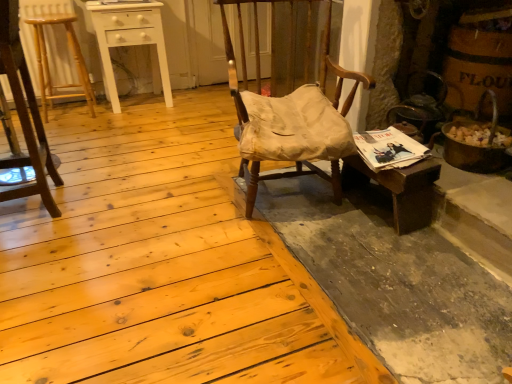
The height and width of the screenshot is (384, 512). I want to click on wooden chair with worn fabric cushion at center, the second chair positioned from the left, so click(244, 51).

Where is `wooden desk at right`? This screenshot has width=512, height=384. wooden desk at right is located at coordinates (401, 189).

What do you see at coordinates (128, 40) in the screenshot? The image size is (512, 384). I see `white wood table at upper left` at bounding box center [128, 40].

What do you see at coordinates (419, 111) in the screenshot? This screenshot has height=384, width=512. I see `metallic gold swivel chair at right` at bounding box center [419, 111].

The image size is (512, 384). Find the location of `light brown wood bar stool at left`. light brown wood bar stool at left is located at coordinates (48, 64).

The width and height of the screenshot is (512, 384). Find the location of `wooden chair with worn fabric cushion at center, the first chair in the right-to-left sequence`. wooden chair with worn fabric cushion at center, the first chair in the right-to-left sequence is located at coordinates (244, 51).

Which of these two, matte paper magazine at right or metallic gold swivel chair at right, stands taller?

metallic gold swivel chair at right is taller.

The width and height of the screenshot is (512, 384). In order to click on swivel chair above the matte paper magazine at right (from a real-world perspective) in this screenshot , I will do `click(419, 111)`.

Would you say matte paper magazine at right is a long distance from metallic gold swivel chair at right?

That's not correct — matte paper magazine at right is a little close to metallic gold swivel chair at right.

Based on their positions, is matte paper magazine at right located to the left or right of metallic gold swivel chair at right?

matte paper magazine at right is positioned on metallic gold swivel chair at right's left side.

Considering the relative sizes of light brown wood bar stool at left and matte paper magazine at right in the image provided, is light brown wood bar stool at left shorter than matte paper magazine at right?

In fact, light brown wood bar stool at left may be taller than matte paper magazine at right.

In the scene shown: Is light brown wood bar stool at left facing towards matte paper magazine at right?

No, light brown wood bar stool at left is not aimed at matte paper magazine at right.

Where is `bar stool above the matte paper magazine at right (from a real-world perspective)`? bar stool above the matte paper magazine at right (from a real-world perspective) is located at coordinates (48, 64).

Is light brown wood bar stool at left at the left side of matte paper magazine at right?

Yes.

How different are the orientations of wooden chair with worn fabric cushion at center, the first chair in the right-to-left sequence, and white wood table at upper left in degrees?

There is a 8.95-degree angle between the facing directions of wooden chair with worn fabric cushion at center, the first chair in the right-to-left sequence, and white wood table at upper left.

Is white wood table at upper left located within wooden chair with worn fabric cushion at center, the second chair positioned from the left?

No, white wood table at upper left is located outside of wooden chair with worn fabric cushion at center, the second chair positioned from the left.

Who is bigger, wooden chair with worn fabric cushion at center, the first chair in the right-to-left sequence, or white wood table at upper left?

wooden chair with worn fabric cushion at center, the first chair in the right-to-left sequence, is bigger.

Considering the positions of objects wooden chair with worn fabric cushion at center, the second chair positioned from the left, and white wood table at upper left in the image provided, who is more to the left, wooden chair with worn fabric cushion at center, the second chair positioned from the left, or white wood table at upper left?

Positioned to the left is white wood table at upper left.

In the scene shown: Which object is more forward, wooden desk at right or matte paper magazine at right?

wooden desk at right is closer to the camera.

Is wooden desk at right at the left side of matte paper magazine at right?

No, wooden desk at right is not to the left of matte paper magazine at right.

Is wooden desk at right shorter than matte paper magazine at right?

No.

Is wooden desk at right positioned with its back to matte paper magazine at right?

No, matte paper magazine at right is not at the back of wooden desk at right.

Can you confirm if metallic gold swivel chair at right is bigger than light brown wood bar stool at left?

Actually, metallic gold swivel chair at right might be smaller than light brown wood bar stool at left.

Measure the distance from metallic gold swivel chair at right to light brown wood bar stool at left.

metallic gold swivel chair at right is 2.34 meters away from light brown wood bar stool at left.

Is metallic gold swivel chair at right positioned before light brown wood bar stool at left?

That is True.

Based on the photo, considering the relative sizes of metallic gold swivel chair at right and light brown wood bar stool at left in the image provided, is metallic gold swivel chair at right wider than light brown wood bar stool at left?

Incorrect, the width of metallic gold swivel chair at right does not surpass that of light brown wood bar stool at left.

You are a GUI agent. You are given a task and a screenshot of the screen. Output one action in this format:
    pyautogui.click(x=<x>, y=<y>)
    Task: Click on the bar stool below the wooden stool at left, which is the 2th chair in right-to-left order (from a real-world perspective)
    The height and width of the screenshot is (384, 512).
    Given the screenshot: What is the action you would take?
    pyautogui.click(x=48, y=64)

Consider the image. Which is closer to the camera, [75,96] or [8,10]?

Point [75,96].

Would you say wooden stool at left, the first chair in the left-to-right sequence, is part of light brown wood bar stool at left's contents?

No.

Looking at their sizes, would you say light brown wood bar stool at left is wider or thinner than wooden stool at left, which is the 2th chair in right-to-left order?

Clearly, light brown wood bar stool at left has more width compared to wooden stool at left, which is the 2th chair in right-to-left order.

Can you confirm if white wood table at upper left is shorter than wooden stool at left, which is the 2th chair in right-to-left order?

Correct, white wood table at upper left is not as tall as wooden stool at left, which is the 2th chair in right-to-left order.

Does white wood table at upper left come behind wooden stool at left, the first chair in the left-to-right sequence?

Yes, white wood table at upper left is further from the viewer.

Is white wood table at upper left oriented towards wooden stool at left, the first chair in the left-to-right sequence?

No, white wood table at upper left is not oriented towards wooden stool at left, the first chair in the left-to-right sequence.

The height and width of the screenshot is (384, 512). There is a matte paper magazine at right. What are the coordinates of `swivel chair above it (from a real-world perspective)` in the screenshot? It's located at (419, 111).

I want to click on bar stool that appears behind the matte paper magazine at right, so click(x=48, y=64).

Which object lies nearer to the anchor point matte paper magazine at right, white wood table at upper left or metallic gold swivel chair at right?

Among the two, metallic gold swivel chair at right is located nearer to matte paper magazine at right.

Considering their positions, is wooden desk at right positioned further to white wood table at upper left than wooden stool at left, the first chair in the left-to-right sequence?

Among the two, wooden desk at right is located further to white wood table at upper left.

In the scene shown: Looking at the image, which one is located closer to light brown wood bar stool at left, matte paper magazine at right or metallic gold swivel chair at right?

The object closer to light brown wood bar stool at left is matte paper magazine at right.

Looking at the image, which one is located further to wooden stool at left, the first chair in the left-to-right sequence, wooden chair with worn fabric cushion at center, the first chair in the right-to-left sequence, or matte paper magazine at right?

matte paper magazine at right is further to wooden stool at left, the first chair in the left-to-right sequence.

Which object lies nearer to the anchor point white wood table at upper left, wooden chair with worn fabric cushion at center, the second chair positioned from the left, or matte paper magazine at right?

wooden chair with worn fabric cushion at center, the second chair positioned from the left, is closer to white wood table at upper left.

Estimate the real-world distances between objects in this image. Which object is further from metallic gold swivel chair at right, light brown wood bar stool at left or wooden stool at left, the first chair in the left-to-right sequence?

light brown wood bar stool at left.

Considering their positions, is wooden desk at right positioned closer to white wood table at upper left than light brown wood bar stool at left?

Among the two, light brown wood bar stool at left is located nearer to white wood table at upper left.

Consider the image. Considering their positions, is metallic gold swivel chair at right positioned closer to wooden chair with worn fabric cushion at center, the first chair in the right-to-left sequence, than white wood table at upper left?

metallic gold swivel chair at right lies closer to wooden chair with worn fabric cushion at center, the first chair in the right-to-left sequence, than the other object.

The height and width of the screenshot is (384, 512). Find the location of `magazine between wooden chair with worn fabric cushion at center, the second chair positioned from the left, and wooden desk at right from left to right`. magazine between wooden chair with worn fabric cushion at center, the second chair positioned from the left, and wooden desk at right from left to right is located at coordinates (389, 149).

The height and width of the screenshot is (384, 512). In order to click on chair located between white wood table at upper left and wooden desk at right in the left-right direction in this screenshot , I will do `click(244, 51)`.

Identify the location of desk between light brown wood bar stool at left and metallic gold swivel chair at right in the horizontal direction. (401, 189).

Identify the location of chair situated between white wood table at upper left and matte paper magazine at right from left to right. This screenshot has height=384, width=512. (244, 51).